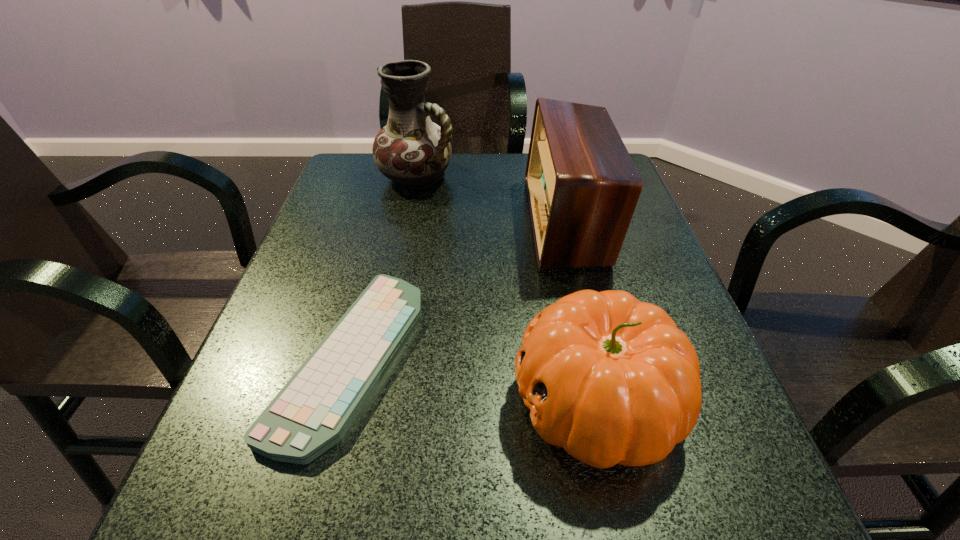
The height and width of the screenshot is (540, 960). I want to click on empty location between the third tallest object and the tallest object, so click(x=507, y=289).

Find the location of a particular element. Image resolution: width=960 pixels, height=540 pixels. unoccupied area between the shortest object and the tallest object is located at coordinates (384, 267).

This screenshot has height=540, width=960. I want to click on free space between the vase and the shortest object, so click(x=384, y=267).

Locate an element on the screen. vacant region between the second shortest object and the computer keyboard is located at coordinates (473, 379).

Image resolution: width=960 pixels, height=540 pixels. Find the location of `object that stands as the closest to the shortest object`. object that stands as the closest to the shortest object is located at coordinates (612, 380).

Locate which object is the closest to the computer keyboard. Please provide its 2D coordinates. Your answer should be formatted as a tuple, i.e. [(x, y)], where the tuple contains the x and y coordinates of a point satisfying the conditions above.

[(612, 380)]